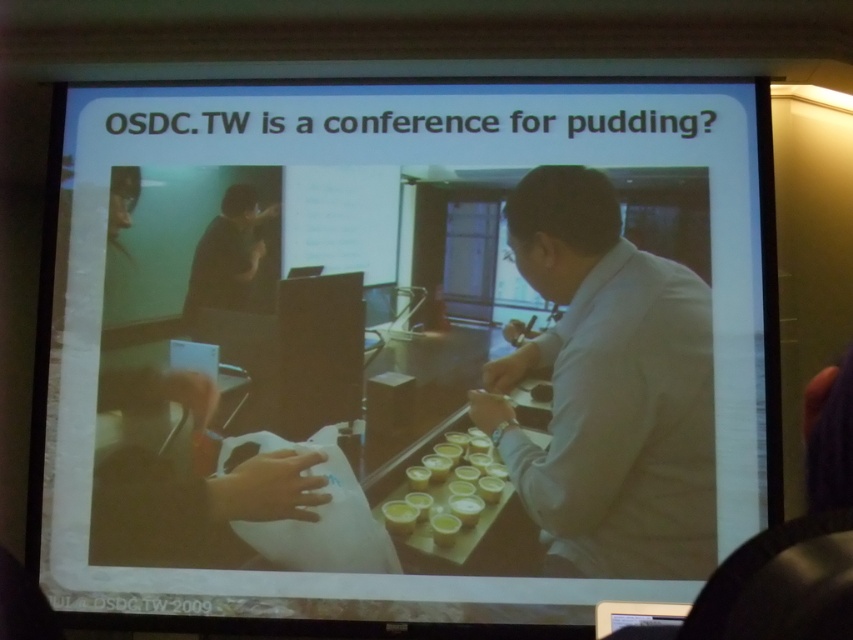
Question: Does white matte paper at lower left have a greater width compared to yellow matte pudding at center?

Choices:
 (A) no
 (B) yes

Answer: (B)

Question: Estimate the real-world distances between objects in this image. Which object is closer to the matte black laptop at center?

Choices:
 (A) white matte paper at lower left
 (B) white paper at center

Answer: (B)

Question: Which object is the closest to the white paper at center?

Choices:
 (A) yellow matte pudding at center
 (B) matte black laptop at center

Answer: (A)

Question: Is white matte paper at lower left closer to camera compared to matte black laptop at center?

Choices:
 (A) no
 (B) yes

Answer: (B)

Question: In this image, where is white shirt at center located relative to matte black laptop at center?

Choices:
 (A) below
 (B) above

Answer: (A)

Question: Among these points, which one is nearest to the camera?

Choices:
 (A) (601, 296)
 (B) (215, 611)
 (C) (235, 262)

Answer: (B)